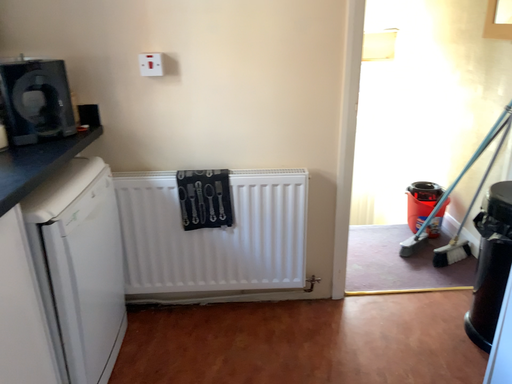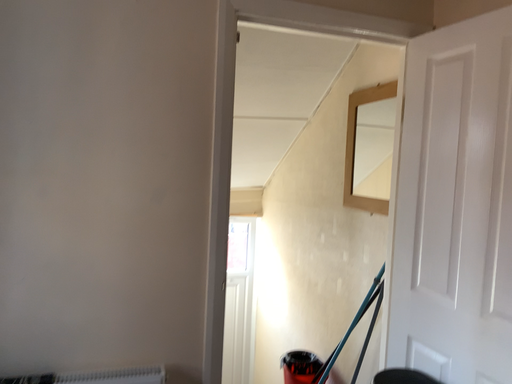
Question: Which way did the camera rotate in the video?

Choices:
 (A) rotated left
 (B) rotated right

Answer: (B)